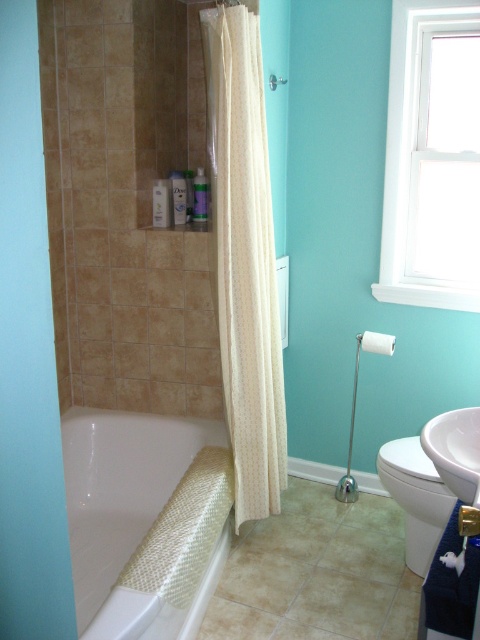
You are a painter who needs to know which object is larger between the white glass window at upper right and the white glossy sink at lower right to decide where to place your ladder. Based on the scene, which one is larger?

The white glass window at upper right is bigger than the white glossy sink at lower right, so you should place your ladder near the white glass window at upper right.

You are standing in the bathroom and want to place a small plant between the two points, point (408, 250) and point (380, 340). Since the plant needs to be closer to you, which point should it be nearer to?

The plant should be placed closer to point (408, 250) because it is closer to the viewer than point (380, 340).